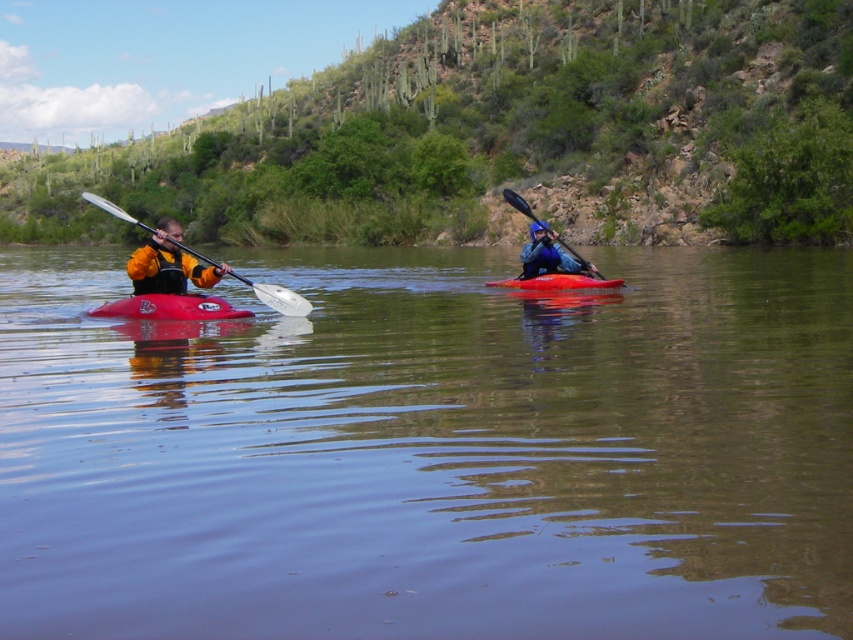
Which of these two, matte red kayak at left or matte red kayak at center, stands shorter?

matte red kayak at center

Is matte red kayak at left bigger than matte red kayak at center?

Correct, matte red kayak at left is larger in size than matte red kayak at center.

Which is in front, point (132, 296) or point (607, 285)?

Point (132, 296)

Find the location of a particular element. The image size is (853, 640). matte red kayak at left is located at coordinates [170, 307].

Can you confirm if matte red kayak at left is positioned below white plastic paddle at left?

Yes, matte red kayak at left is below white plastic paddle at left.

Between point (180, 296) and point (231, 269), which one is positioned behind?

Point (180, 296)

Where is `matte red kayak at left`? The width and height of the screenshot is (853, 640). matte red kayak at left is located at coordinates (170, 307).

Is green leafy hillside at upper center to the right of blue matte kayak at center from the viewer's perspective?

Incorrect, green leafy hillside at upper center is not on the right side of blue matte kayak at center.

The width and height of the screenshot is (853, 640). Describe the element at coordinates (502, 134) in the screenshot. I see `green leafy hillside at upper center` at that location.

This screenshot has height=640, width=853. What do you see at coordinates (502, 134) in the screenshot?
I see `green leafy hillside at upper center` at bounding box center [502, 134].

The width and height of the screenshot is (853, 640). Find the location of `green leafy hillside at upper center`. green leafy hillside at upper center is located at coordinates (502, 134).